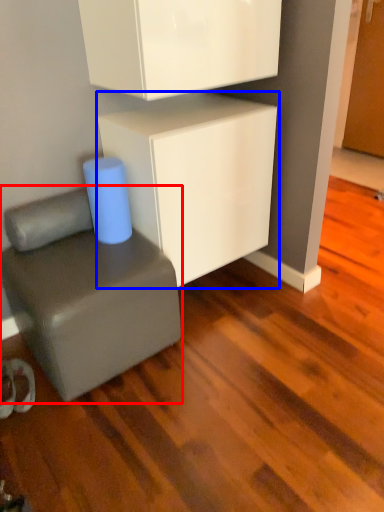
Question: Which point is further to the camera, furniture (highlighted by a red box) or cabinetry (highlighted by a blue box)?

Choices:
 (A) furniture
 (B) cabinetry

Answer: (B)